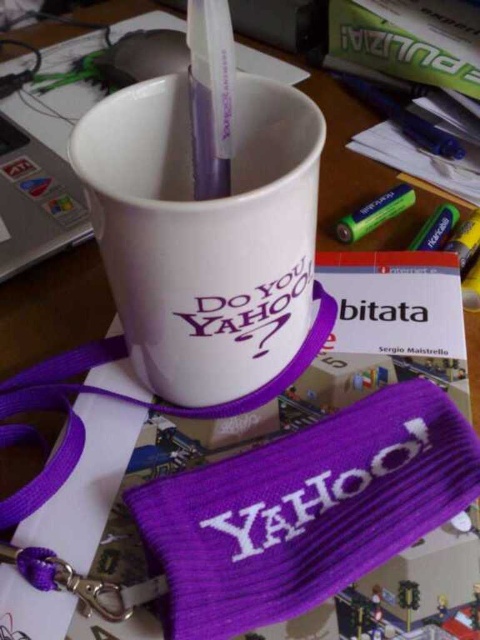
Question: Among these objects, which one is farthest from the camera?

Choices:
 (A) white plastic pencil at upper center
 (B) green matte crayon at upper right
 (C) white ceramic mug at center

Answer: (B)

Question: Does green matte crayon at upper right have a larger size compared to green matte crayon at lower right?

Choices:
 (A) yes
 (B) no

Answer: (A)

Question: Is white ceramic mug at center below white plastic pencil at upper center?

Choices:
 (A) yes
 (B) no

Answer: (A)

Question: Which point appears closest to the camera in this image?

Choices:
 (A) (427, 220)
 (B) (259, 323)
 (C) (376, 211)
 (D) (202, 93)

Answer: (D)

Question: Among these objects, which one is farthest from the camera?

Choices:
 (A) green matte crayon at lower right
 (B) white ceramic mug at center
 (C) white plastic pencil at upper center

Answer: (A)

Question: Does green matte crayon at upper right come in front of green matte crayon at lower right?

Choices:
 (A) no
 (B) yes

Answer: (A)